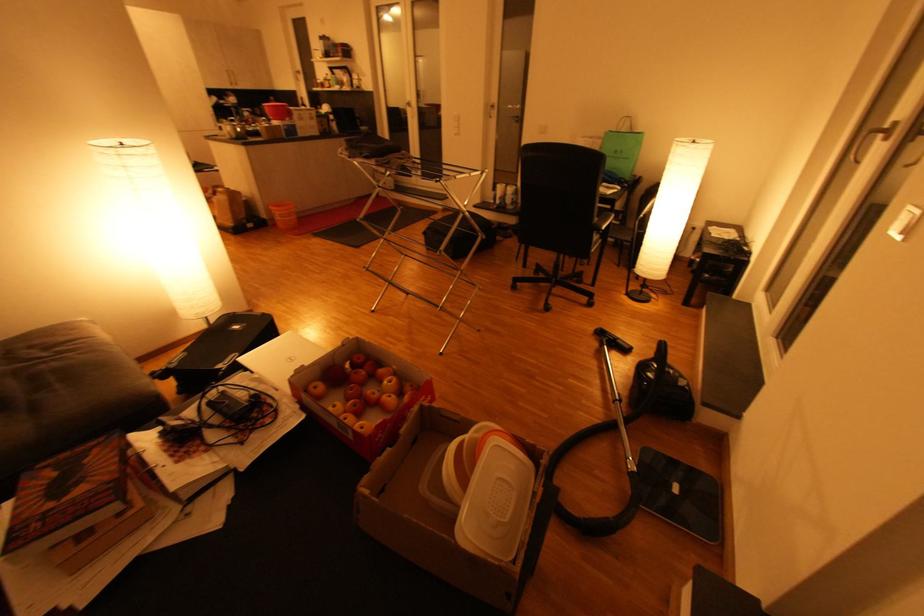
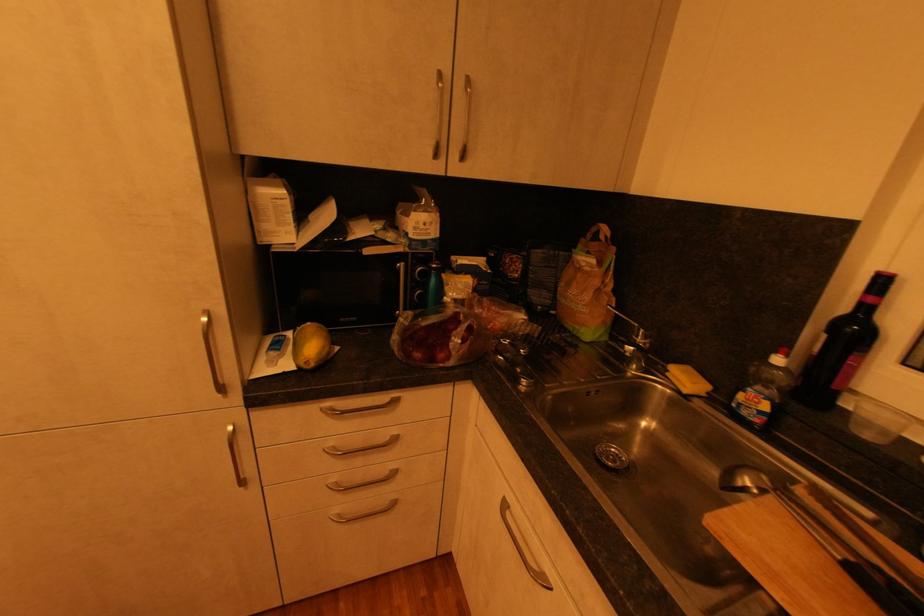
Where in the second image is the point corresponding to pixel 237 86 from the first image?

(441, 156)